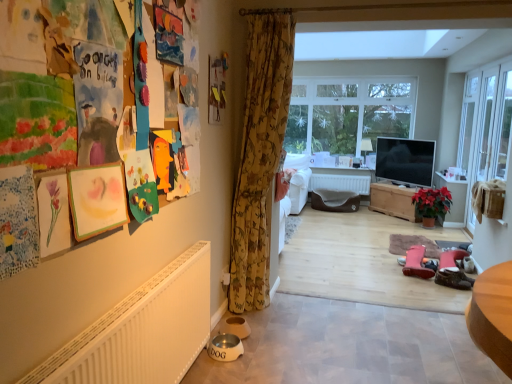
The image size is (512, 384). I want to click on green matte poinsettia at center-right, so click(432, 201).

What is the approximate height of floral fabric curtain at center?

2.09 meters.

The width and height of the screenshot is (512, 384). What do you see at coordinates (340, 183) in the screenshot?
I see `white matte radiator at lower left` at bounding box center [340, 183].

What do you see at coordinates (453, 278) in the screenshot? I see `brown leather shoes at lower right` at bounding box center [453, 278].

In order to face brown leather shoes at lower right, should I rotate leftwards or rightwards?

Turn right approximately 24.755 degrees to face it.

What are the coordinates of `green matte poinsettia at center-right` in the screenshot? It's located at (432, 201).

Which is behind, wooden chest at center or green matte poinsettia at center-right?

Positioned behind is wooden chest at center.

Could you tell me if wooden chest at center is facing green matte poinsettia at center-right?

No, wooden chest at center is not turned towards green matte poinsettia at center-right.

From the image's perspective, is wooden chest at center located above or below green matte poinsettia at center-right?

From the image's perspective, wooden chest at center appears above green matte poinsettia at center-right.

Does wooden chest at center have a greater height compared to clear glass screen door at right?

No, wooden chest at center is not taller than clear glass screen door at right.

Is wooden chest at center touching clear glass screen door at right?

No, wooden chest at center is not making contact with clear glass screen door at right.

Looking at their sizes, would you say wooden chest at center is wider or thinner than clear glass screen door at right?

In the image, wooden chest at center appears to be wider than clear glass screen door at right.

From the picture: Considering the positions of objects green matte poinsettia at center-right and clear glass screen door at right in the image provided, who is more to the right, green matte poinsettia at center-right or clear glass screen door at right?

clear glass screen door at right is more to the right.

Could you tell me if green matte poinsettia at center-right is facing clear glass screen door at right?

No, green matte poinsettia at center-right does not turn towards clear glass screen door at right.

Can you tell me how much green matte poinsettia at center-right and clear glass screen door at right differ in facing direction?

97.7 degrees separate the facing orientations of green matte poinsettia at center-right and clear glass screen door at right.

Is the position of green matte poinsettia at center-right less distant than that of clear glass screen door at right?

No, green matte poinsettia at center-right is behind clear glass screen door at right.

Considering their positions, is green matte poinsettia at center-right located in front of or behind white matte radiator at lower left?

Visually, green matte poinsettia at center-right is located in front of white matte radiator at lower left.

Is green matte poinsettia at center-right completely or partially outside of white matte radiator at lower left?

Yes.

Considering the relative sizes of green matte poinsettia at center-right and white matte radiator at lower left in the image provided, is green matte poinsettia at center-right wider than white matte radiator at lower left?

Yes, green matte poinsettia at center-right is wider than white matte radiator at lower left.

Is green matte poinsettia at center-right to the left or to the right of white matte radiator at lower left in the image?

From the image, it's evident that green matte poinsettia at center-right is to the right of white matte radiator at lower left.

Is floral fabric curtain at center with brown leather shoes at lower right?

floral fabric curtain at center is not next to brown leather shoes at lower right, and they're not touching.

From a real-world perspective, is floral fabric curtain at center physically below brown leather shoes at lower right?

Incorrect, from a real-world perspective, floral fabric curtain at center is higher than brown leather shoes at lower right.

Which is closer to the camera, (247, 187) or (439, 280)?

The point (247, 187) is closer.

Is floral fabric curtain at center oriented towards brown leather shoes at lower right?

No, floral fabric curtain at center does not turn towards brown leather shoes at lower right.

From the image's perspective, which object appears higher, white matte radiator at lower left or clear glass screen door at right?

clear glass screen door at right appears higher in the image.

From the picture: Does white matte radiator at lower left appear on the left side of clear glass screen door at right?

Yes, white matte radiator at lower left is to the left of clear glass screen door at right.

Is white matte radiator at lower left far away from clear glass screen door at right?

white matte radiator at lower left is positioned a significant distance from clear glass screen door at right.

In the image, is white matte radiator at lower left positioned in front of or behind clear glass screen door at right?

white matte radiator at lower left is positioned farther from the viewer than clear glass screen door at right.

Does brown leather shoes at lower right contain floral fabric curtain at center?

No.

Is brown leather shoes at lower right positioned with its back to floral fabric curtain at center?

No, floral fabric curtain at center is not at the back of brown leather shoes at lower right.

Is brown leather shoes at lower right taller or shorter than floral fabric curtain at center?

brown leather shoes at lower right is shorter than floral fabric curtain at center.

Between brown leather shoes at lower right and floral fabric curtain at center, which one has larger size?

floral fabric curtain at center.

Find the location of `desk below the green matte poinsettia at center-right (from a real-world perspective)`. desk below the green matte poinsettia at center-right (from a real-world perspective) is located at coordinates (393, 201).

Where is `desk behind the clear glass screen door at right`? The height and width of the screenshot is (384, 512). desk behind the clear glass screen door at right is located at coordinates (393, 201).

Consider the image. Based on their spatial positions, is green matte poinsettia at center-right or floral fabric curtain at center further from white matte radiator at lower left?

floral fabric curtain at center.

Considering their positions, is white matte radiator at lower left positioned closer to floral fabric curtain at center than clear glass window at center?

white matte radiator at lower left is closer to floral fabric curtain at center.

When comparing their distances from clear glass window at center, does white matte radiator at lower left or floral fabric curtain at center seem further?

floral fabric curtain at center lies further to clear glass window at center than the other object.

Which object lies nearer to the anchor point brown leather shoes at lower right, wooden chest at center or green matte poinsettia at center-right?

Based on the image, green matte poinsettia at center-right appears to be nearer to brown leather shoes at lower right.

Considering their positions, is wooden chest at center positioned closer to clear glass screen door at right than green matte poinsettia at center-right?

green matte poinsettia at center-right is positioned closer to the anchor clear glass screen door at right.

When comparing their distances from white matte radiator at lower left, does brown leather shoes at lower right or wooden chest at center seem closer?

The object closer to white matte radiator at lower left is wooden chest at center.

Estimate the real-world distances between objects in this image. Which object is closer to clear glass window at center, wooden chest at center or green matte poinsettia at center-right?

Among the two, wooden chest at center is located nearer to clear glass window at center.

Looking at the image, which one is located further to clear glass screen door at right, white matte radiator at lower left or wooden chest at center?

white matte radiator at lower left lies further to clear glass screen door at right than the other object.

Where is `window between green matte poinsettia at center-right and white matte radiator at lower left from front to back`? window between green matte poinsettia at center-right and white matte radiator at lower left from front to back is located at coordinates (348, 114).

Where is `radiator between clear glass window at center and wooden chest at center from top to bottom`? Image resolution: width=512 pixels, height=384 pixels. radiator between clear glass window at center and wooden chest at center from top to bottom is located at coordinates (340, 183).

Find the location of a particular element. flower located between clear glass screen door at right and white matte radiator at lower left in the depth direction is located at coordinates (432, 201).

Where is `footwear between floral fabric curtain at center and clear glass screen door at right`? footwear between floral fabric curtain at center and clear glass screen door at right is located at coordinates (453, 278).